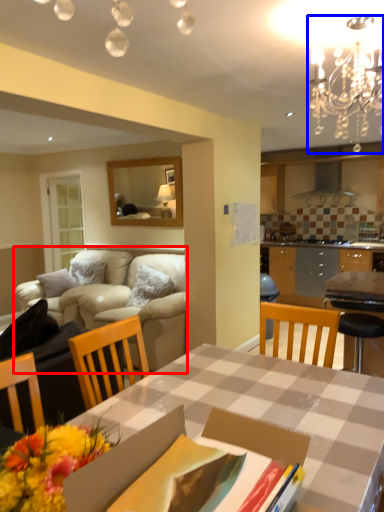
Question: Which of the following is the farthest to the observer, studio couch (highlighted by a red box) or light fixture (highlighted by a blue box)?

Choices:
 (A) studio couch
 (B) light fixture

Answer: (A)